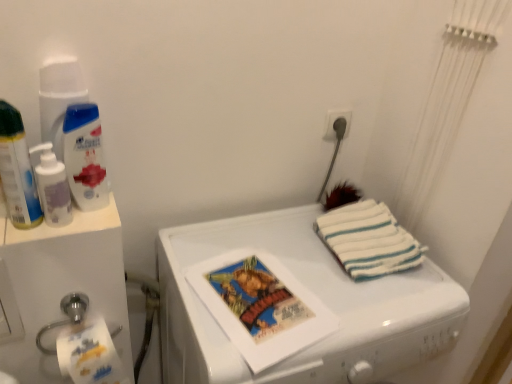
The width and height of the screenshot is (512, 384). Identify the location of free space in front of white striped towel at right. (371, 304).